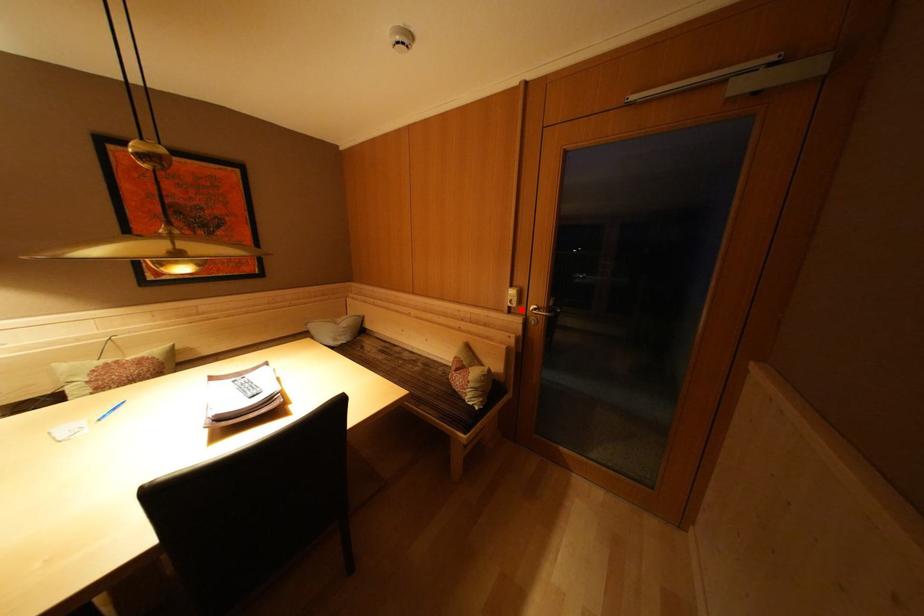
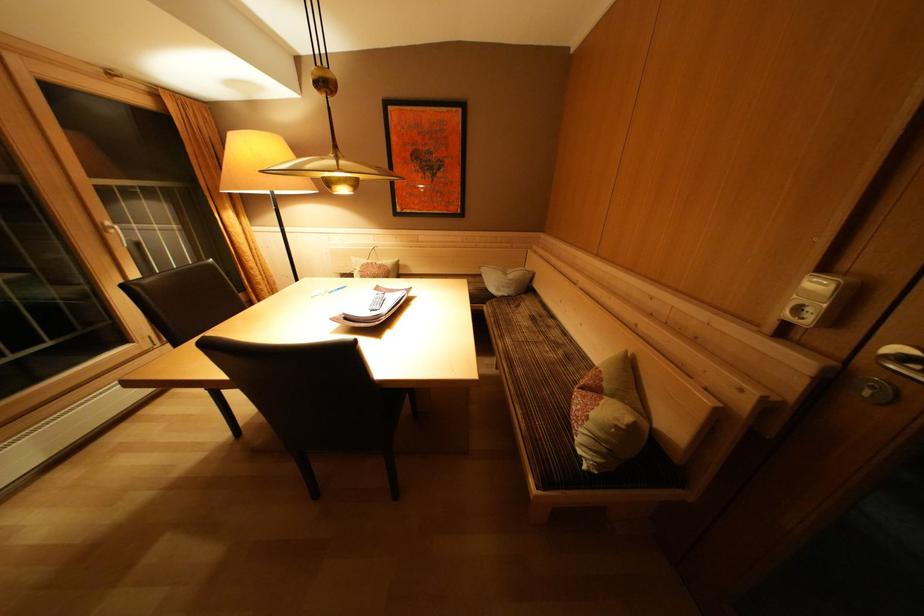
Locate, in the second image, the point that corresponds to the highlighted location in the first image.

(815, 326)